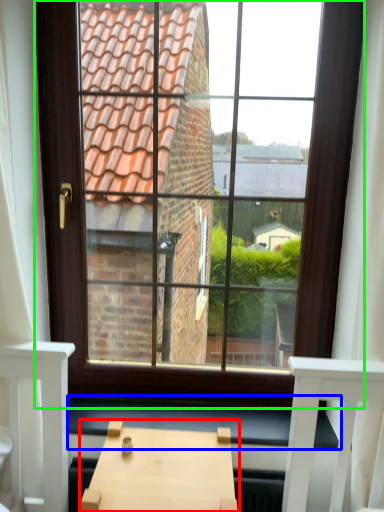
Question: Considering the real-world distances, which object is farthest from table (highlighted by a red box)? window sill (highlighted by a blue box) or window (highlighted by a green box)?

Choices:
 (A) window sill
 (B) window

Answer: (B)